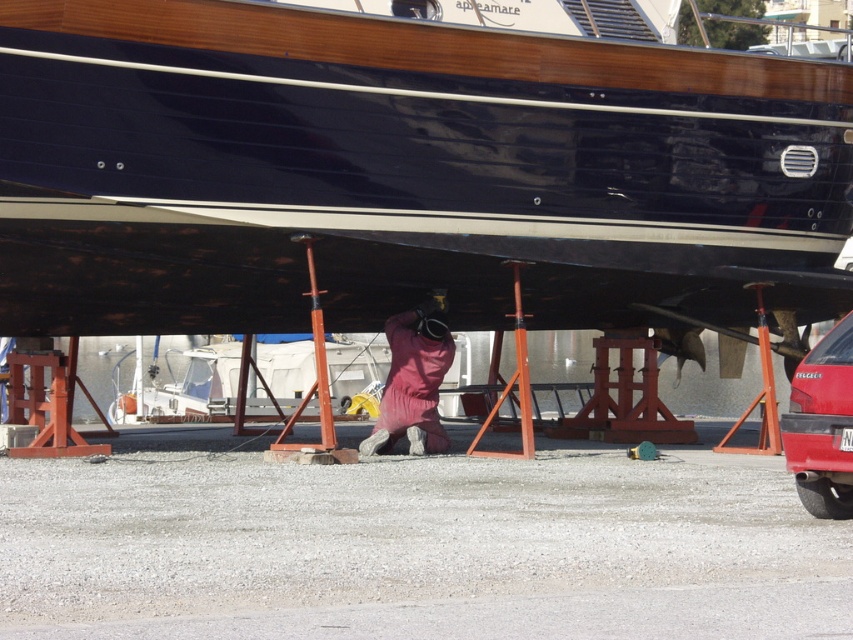
The width and height of the screenshot is (853, 640). What do you see at coordinates (822, 426) in the screenshot?
I see `shiny red car at lower right` at bounding box center [822, 426].

Looking at this image, between shiny red car at lower right and pink fabric at center, which one appears on the right side from the viewer's perspective?

shiny red car at lower right is more to the right.

What do you see at coordinates (822, 426) in the screenshot? I see `shiny red car at lower right` at bounding box center [822, 426].

The image size is (853, 640). Find the location of `shiny red car at lower right`. shiny red car at lower right is located at coordinates (822, 426).